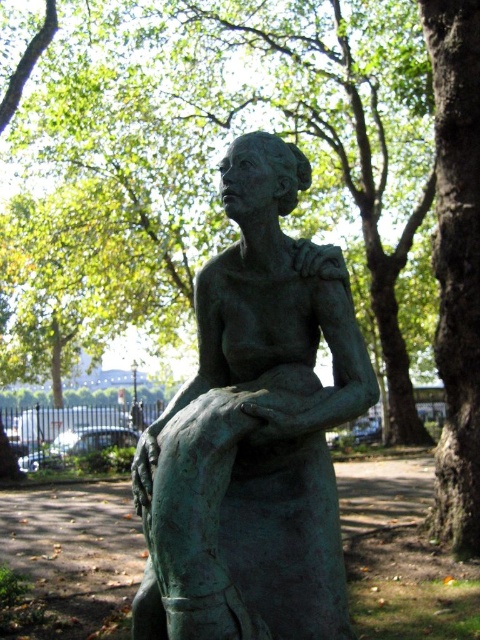
You are an artist planning to sketch the scene. You need to decide which object to draw first based on their sizes. Which should you start with, the green patina bronze statue at center or the green rough bark tree at center right?

The green patina bronze statue at center is wider than the green rough bark tree at center right, so you should start with the green patina bronze statue at center since it is larger in width.

You are a photographer planning to capture both the green patina tree at center and the green patina bronze statue at center in a single frame. Based on their widths, which object would require more space to fully include in the photo?

The green patina tree at center requires more space in the photo because its width surpasses that of the green patina bronze statue at center.

You are standing in front of the bronze statue of a seated woman in the park. You notice two points on the statue labeled as point (x=263, y=461) and point (x=432, y=20). Which of these points is closer to your viewpoint?

Point (x=263, y=461) is closer to the camera than point (x=432, y=20), so the point labeled (x=263, y=461) is closer to your viewpoint.